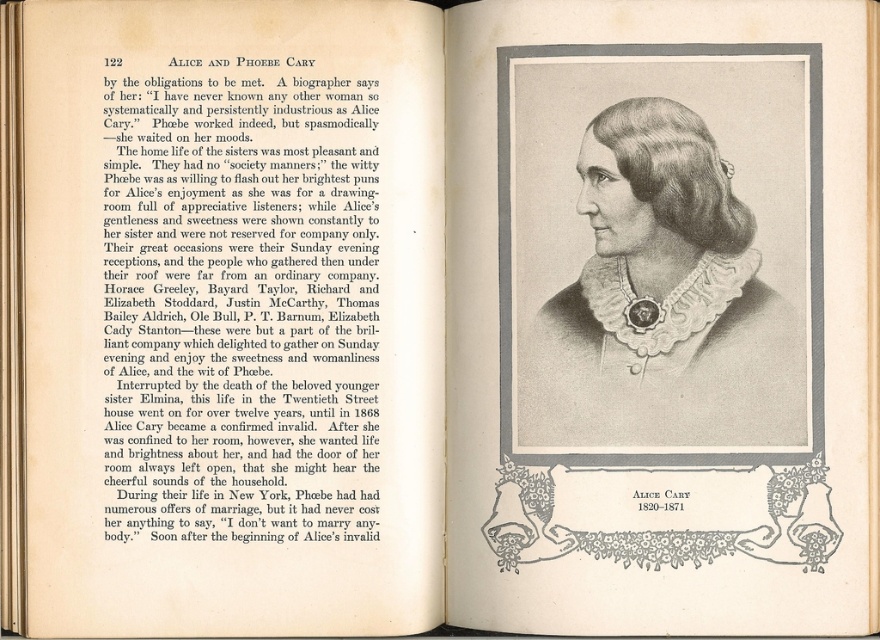
Which is behind, point (202, 282) or point (541, 394)?

The point (541, 394) is more distant.

Between black paper text at upper left and black and white portrait at center, which one is positioned higher?

black and white portrait at center is higher up.

Which is behind, point (302, 394) or point (651, 161)?

Positioned behind is point (651, 161).

In order to click on black paper text at upper left in this screenshot , I will do `click(242, 301)`.